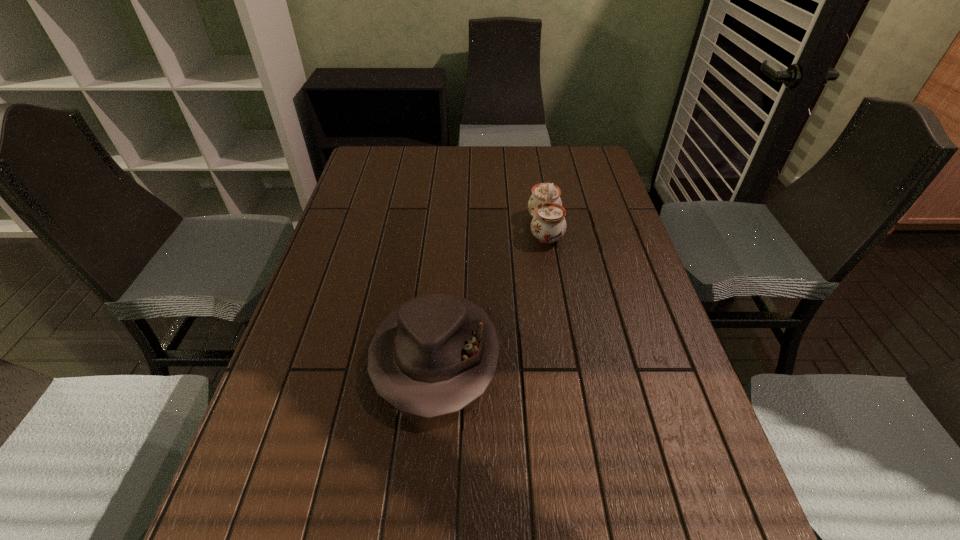
At what (x,y) coordinates should I click in order to perform the action: click on vacant region that satisfies the following two spatial constraints: 1. by the handle of the chinaware; 2. on the decorative side of the shorter object. Please return your answer as a coordinate pair (x, y). The height and width of the screenshot is (540, 960). Looking at the image, I should click on (567, 356).